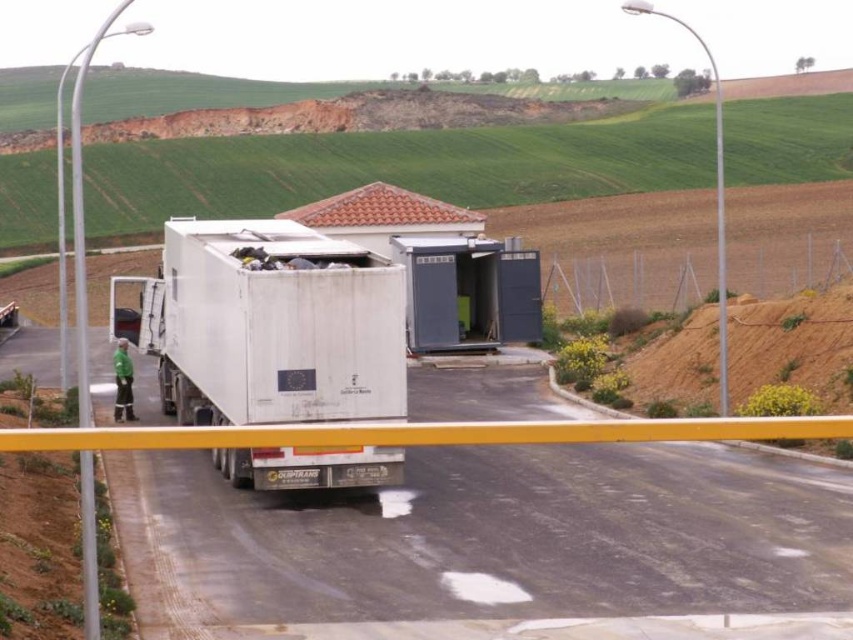
Question: Which point is closer to the camera?

Choices:
 (A) white matte truck at center
 (B) white matte trailer truck at center

Answer: (B)

Question: Can you confirm if white matte truck at center is positioned above white matte trailer truck at center?

Choices:
 (A) yes
 (B) no

Answer: (B)

Question: Can you confirm if white matte truck at center is bigger than white matte trailer truck at center?

Choices:
 (A) yes
 (B) no

Answer: (B)

Question: Can you confirm if white matte truck at center is bigger than white matte trailer truck at center?

Choices:
 (A) no
 (B) yes

Answer: (A)

Question: Which of the following is the farthest from the observer?

Choices:
 (A) white matte truck at center
 (B) white matte trailer truck at center

Answer: (A)